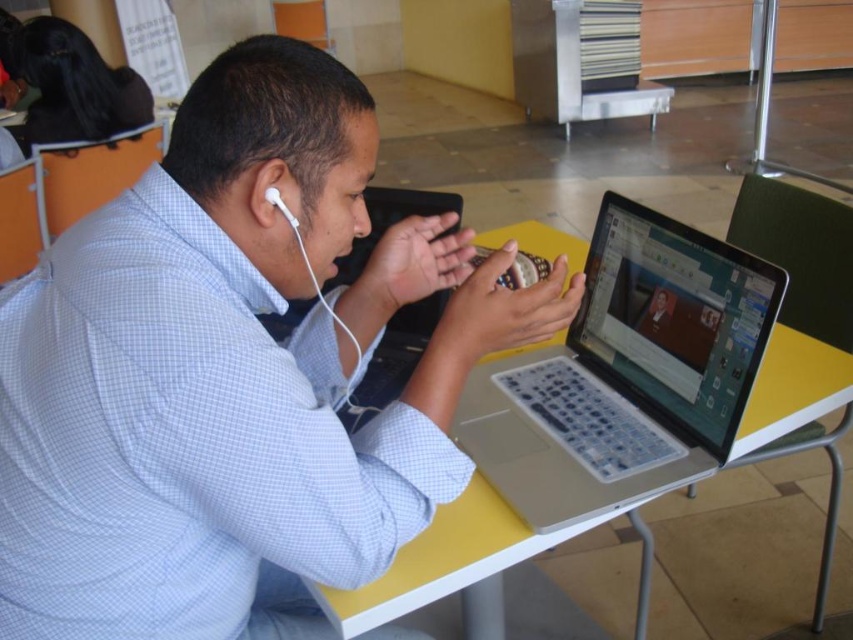
Based on the photo, does white checkered shirt at center appear on the left side of white earphone at left?

Incorrect, white checkered shirt at center is not on the left side of white earphone at left.

Can you confirm if white checkered shirt at center is smaller than white earphone at left?

No, white checkered shirt at center is not smaller than white earphone at left.

Describe the element at coordinates (231, 372) in the screenshot. I see `white checkered shirt at center` at that location.

Find the location of `white checkered shirt at center`. white checkered shirt at center is located at coordinates (231, 372).

Which of these two, silver plastic laptop at center or white plastic earphone at left, stands shorter?

Standing shorter between the two is white plastic earphone at left.

Does point (538, 428) come behind point (289, 216)?

Yes, it is behind point (289, 216).

Where is `silver plastic laptop at center`? The width and height of the screenshot is (853, 640). silver plastic laptop at center is located at coordinates (625, 372).

Where is `silver plastic laptop at center`? Image resolution: width=853 pixels, height=640 pixels. silver plastic laptop at center is located at coordinates (625, 372).

From the picture: Between white checkered shirt at center and yellow plastic table at center, which one appears on the left side from the viewer's perspective?

Positioned to the left is white checkered shirt at center.

Is white checkered shirt at center to the right of yellow plastic table at center from the viewer's perspective?

In fact, white checkered shirt at center is to the left of yellow plastic table at center.

I want to click on white checkered shirt at center, so click(231, 372).